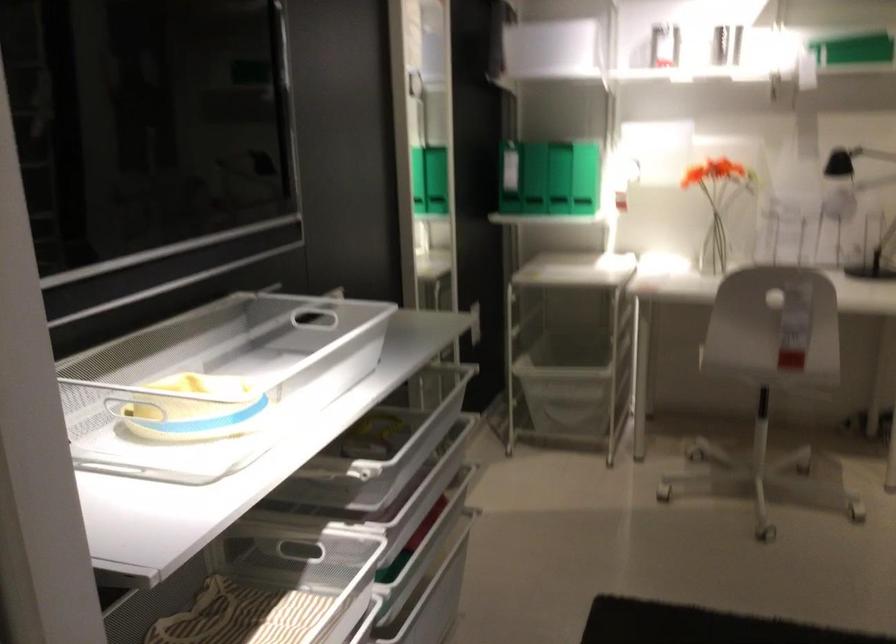
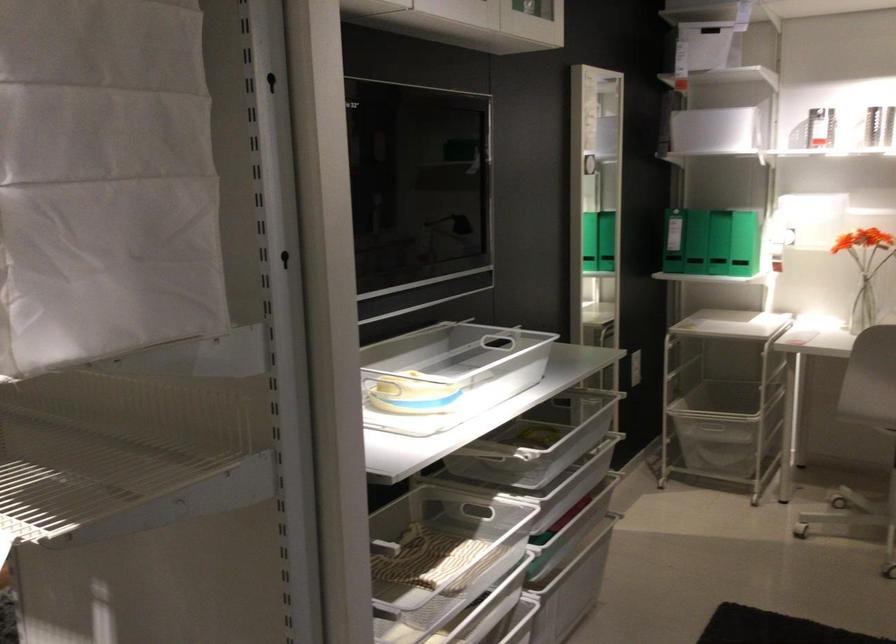
The point at (x=519, y=185) is marked in the first image. Where is the corresponding point in the second image?

(695, 242)